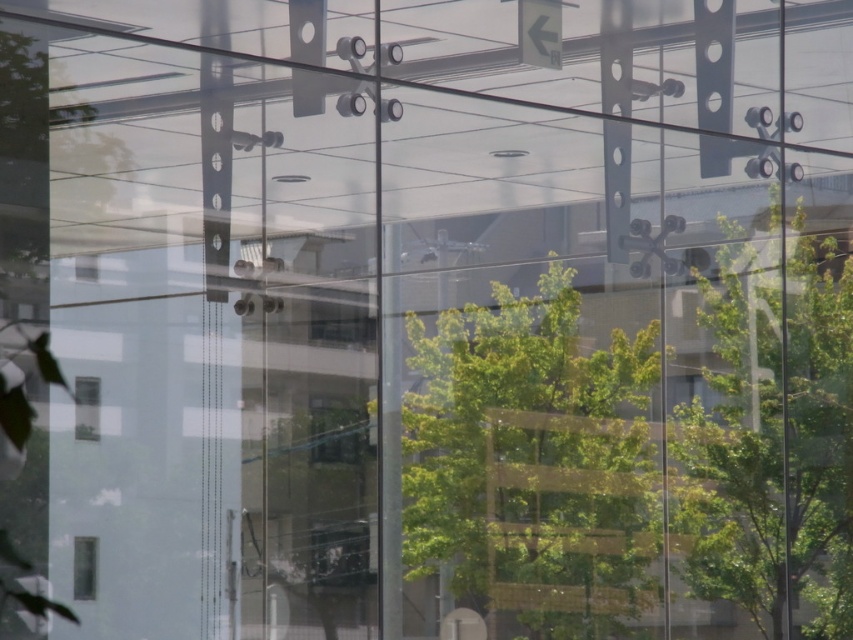
Based on the photo, does clear glass window at lower left appear on the right side of transparent glass window at lower left?

No, clear glass window at lower left is not to the right of transparent glass window at lower left.

Locate an element on the screen. The width and height of the screenshot is (853, 640). clear glass window at lower left is located at coordinates (86, 406).

Does point (77, 432) come in front of point (84, 563)?

No.

Image resolution: width=853 pixels, height=640 pixels. I want to click on clear glass window at lower left, so click(x=86, y=406).

Does point (468, 602) come closer to viewer compared to point (74, 385)?

That is False.

Can you confirm if green leafy tree at center is positioned to the left of clear glass window at lower left?

In fact, green leafy tree at center is to the right of clear glass window at lower left.

Between point (547, 508) and point (86, 404), which one is positioned in front?

Point (86, 404)

Find the location of a particular element. green leafy tree at center is located at coordinates (532, 461).

The height and width of the screenshot is (640, 853). Identify the location of green leafy tree at right. (770, 433).

Can you confirm if green leafy tree at right is shorter than transparent glass window at lower left?

No.

Describe the element at coordinates (770, 433) in the screenshot. This screenshot has width=853, height=640. I see `green leafy tree at right` at that location.

Image resolution: width=853 pixels, height=640 pixels. I want to click on green leafy tree at right, so click(770, 433).